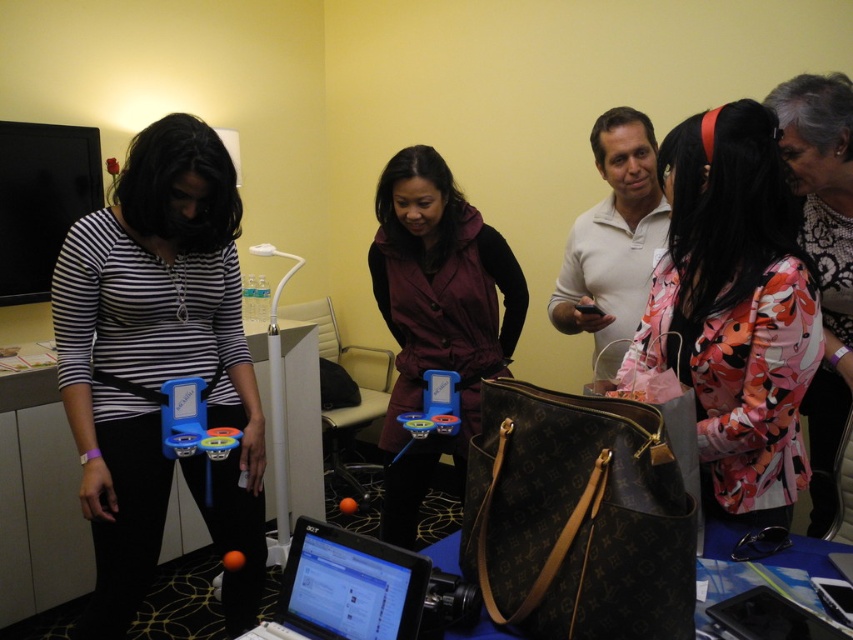
You are a tailor who needs to determine which item is taller between the floral fabric jacket at center and the black glossy laptop at center. Based on the scene description, which item is taller?

The floral fabric jacket at center is taller than the black glossy laptop at center according to the description.

You are standing in the room and want to reach both the point at coordinates (x=671, y=333) and the point at coordinates (x=334, y=628). Which point is closer to you?

Point (x=671, y=333) is closer to you because it is further to the viewer than point (x=334, y=628).